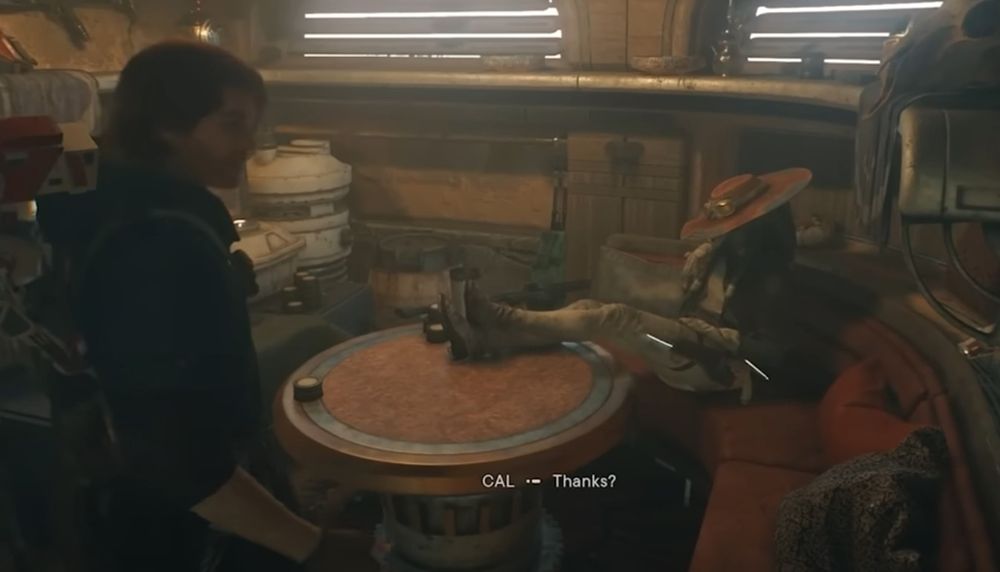
Where is `bench`? The height and width of the screenshot is (572, 1000). bench is located at coordinates (773, 438), (762, 510).